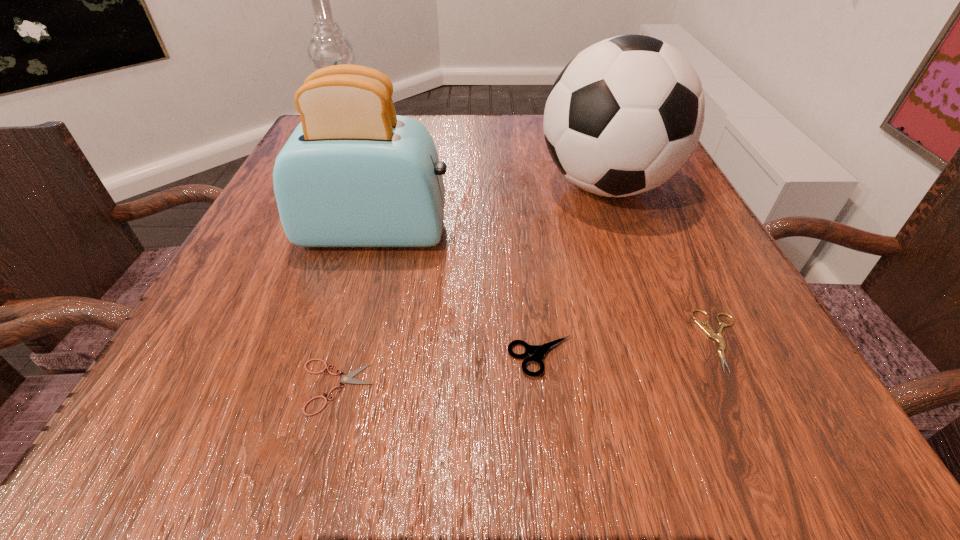
You are a GUI agent. You are given a task and a screenshot of the screen. Output one action in this format:
    pyautogui.click(x=<x>, y=<y>)
    Task: Click on the soccer ball situated at the right edge
    
    Given the screenshot: What is the action you would take?
    pyautogui.click(x=624, y=116)

Where is `shears situated at the right edge`? This screenshot has width=960, height=540. shears situated at the right edge is located at coordinates (709, 331).

The height and width of the screenshot is (540, 960). Find the location of `object positioned at the far left corner`. object positioned at the far left corner is located at coordinates (328, 46).

Locate an element on the screen. This screenshot has height=540, width=960. object present at the far right corner is located at coordinates (624, 116).

In the image, there is a desktop. Find the location of `vacant space at the far edge`. vacant space at the far edge is located at coordinates (529, 127).

Locate an element on the screen. free space at the near edge of the desktop is located at coordinates point(606,432).

Image resolution: width=960 pixels, height=540 pixels. I want to click on vacant area at the left edge, so click(281, 238).

Locate an element on the screen. The height and width of the screenshot is (540, 960). free location at the right edge is located at coordinates (656, 290).

Image resolution: width=960 pixels, height=540 pixels. Find the location of `vacant space at the near left corner of the desktop`. vacant space at the near left corner of the desktop is located at coordinates (156, 401).

This screenshot has width=960, height=540. In order to click on blank space at the near right corner of the desktop in this screenshot , I will do `click(803, 407)`.